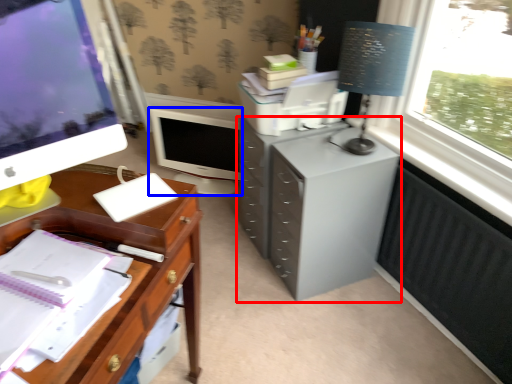
Question: Which object is closer to the camera taking this photo, filing cabinet (highlighted by a red box) or computer monitor (highlighted by a blue box)?

Choices:
 (A) filing cabinet
 (B) computer monitor

Answer: (A)